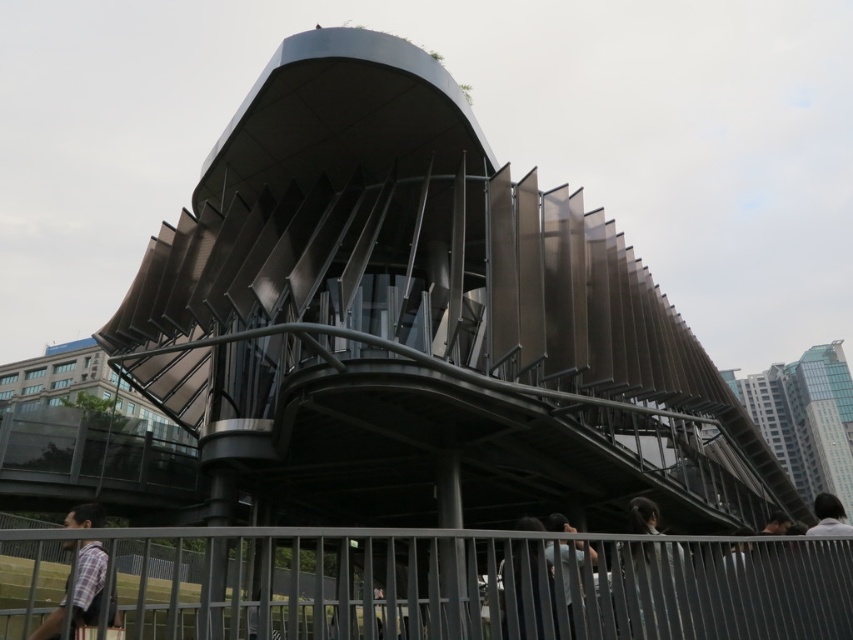
You are standing at the metal railing in front of the modern building. You notice two points marked on the ground. One is at coordinate point [407,570] and the other is at point [51,612]. Which point is closer to you?

Point [407,570] is further to the viewer than point [51,612], so the point closer to you is point [51,612].

You are a visitor at this modern building and want to take a photo of the plaid shirt at lower left through the gray metal fence at lower center. Since the fence is in front of the shirt, will you need to adjust your camera angle to capture the shirt clearly?

The gray metal fence at lower center is bigger than plaid shirt at lower left, so the fence may obstruct the view of the shirt. You might need to move closer or adjust your angle to avoid the fence.

You are a delivery robot with a height of 1.8 meters. You need to pass through the area near the gray metal fence at lower center. Can you safely navigate the space between the fence and the camera without hitting your head?

The distance between the gray metal fence at lower center and the camera is 2.17 meters. Since the robot is 1.8 meters tall, there is enough vertical clearance, so it can safely navigate the space.